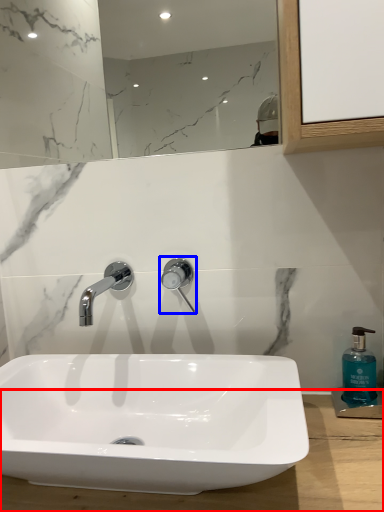
Question: Which object is further to the camera taking this photo, counter top (highlighted by a red box) or tap (highlighted by a blue box)?

Choices:
 (A) counter top
 (B) tap

Answer: (B)